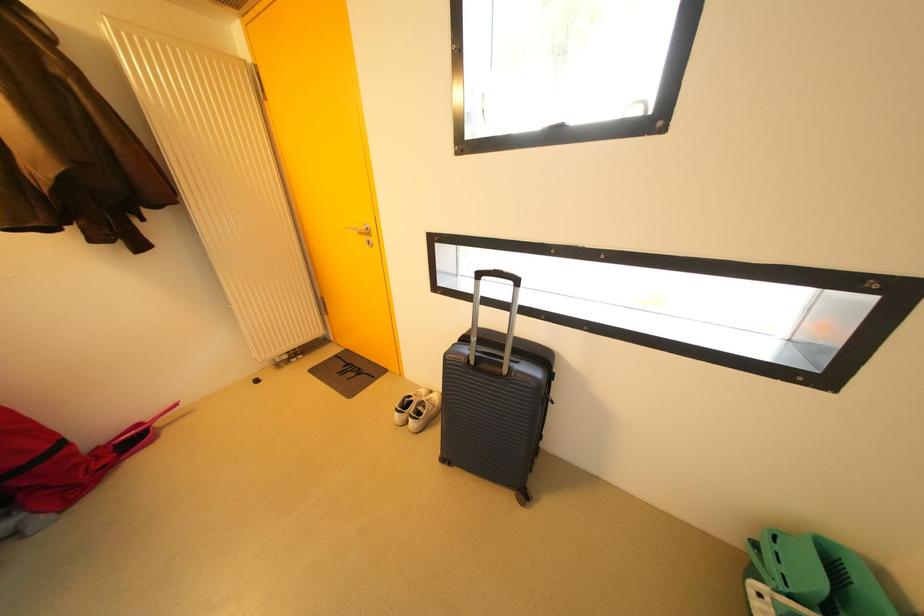
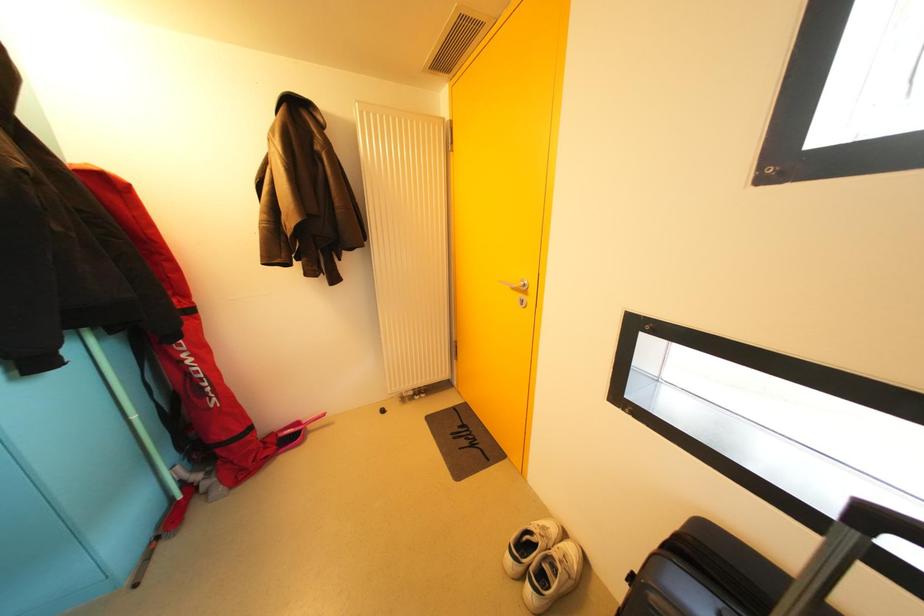
Question: The camera is either moving clockwise (left) or counter-clockwise (right) around the object. The first image is from the beginning of the video and the second image is from the end. Is the camera moving left or right when shooting the video?

Choices:
 (A) Left
 (B) Right

Answer: (B)